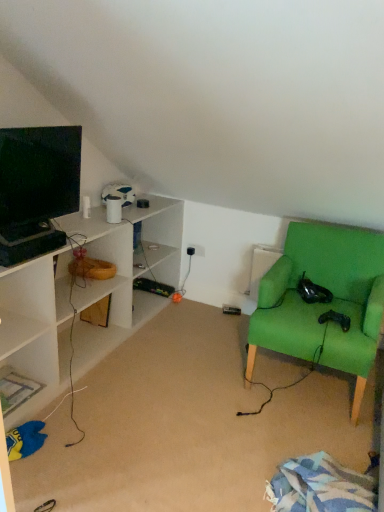
Question: Is black plastic electric outlet at center not close to green fabric chair at right?

Choices:
 (A) yes
 (B) no

Answer: (A)

Question: Can we say black plastic electric outlet at center lies outside green fabric chair at right?

Choices:
 (A) no
 (B) yes

Answer: (B)

Question: Does black plastic electric outlet at center lie in front of green fabric chair at right?

Choices:
 (A) yes
 (B) no

Answer: (B)

Question: Can you confirm if black plastic electric outlet at center is thinner than green fabric chair at right?

Choices:
 (A) yes
 (B) no

Answer: (A)

Question: Could you tell me if black plastic electric outlet at center is turned towards green fabric chair at right?

Choices:
 (A) no
 (B) yes

Answer: (A)

Question: Considering the relative sizes of black plastic electric outlet at center and green fabric chair at right in the image provided, is black plastic electric outlet at center shorter than green fabric chair at right?

Choices:
 (A) yes
 (B) no

Answer: (B)

Question: From the image's perspective, would you say matte black monitor at left is positioned over green fabric chair at right?

Choices:
 (A) yes
 (B) no

Answer: (A)

Question: Is matte black monitor at left shorter than green fabric chair at right?

Choices:
 (A) no
 (B) yes

Answer: (B)

Question: From the image's perspective, does matte black monitor at left appear lower than green fabric chair at right?

Choices:
 (A) no
 (B) yes

Answer: (A)

Question: Does matte black monitor at left appear on the right side of green fabric chair at right?

Choices:
 (A) no
 (B) yes

Answer: (A)

Question: Considering the relative sizes of matte black monitor at left and green fabric chair at right in the image provided, is matte black monitor at left taller than green fabric chair at right?

Choices:
 (A) no
 (B) yes

Answer: (A)

Question: Is matte black monitor at left facing away from green fabric chair at right?

Choices:
 (A) yes
 (B) no

Answer: (B)

Question: Considering the relative sizes of matte black monitor at left and black plastic electric outlet at center in the image provided, is matte black monitor at left shorter than black plastic electric outlet at center?

Choices:
 (A) yes
 (B) no

Answer: (B)